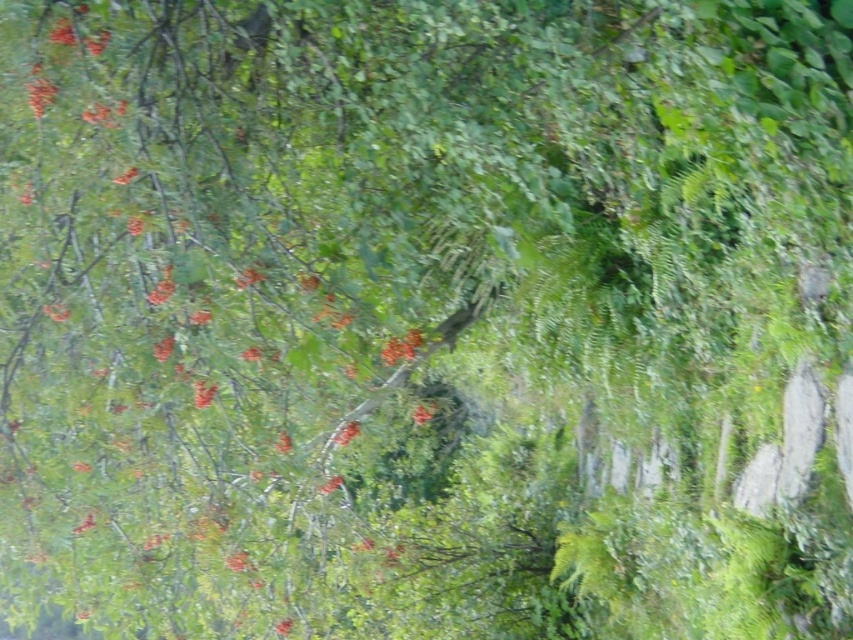
Question: Which object appears farthest from the camera in this image?

Choices:
 (A) bright orange berries at center
 (B) orange matte flower at center
 (C) glossy red flower at center

Answer: (A)

Question: Is glossy red flower at center in front of bright orange berries at center?

Choices:
 (A) yes
 (B) no

Answer: (A)

Question: Based on their relative distances, which object is nearer to the bright orange berries at center?

Choices:
 (A) glossy red flower at center
 (B) orange matte flower at center

Answer: (B)

Question: Which object appears closest to the camera in this image?

Choices:
 (A) glossy red flower at center
 (B) orange matte flower at center
 (C) bright orange berries at center

Answer: (A)

Question: Can you confirm if glossy red flower at center is smaller than orange matte flower at center?

Choices:
 (A) yes
 (B) no

Answer: (B)

Question: Is glossy red flower at center further to camera compared to orange matte flower at center?

Choices:
 (A) yes
 (B) no

Answer: (B)